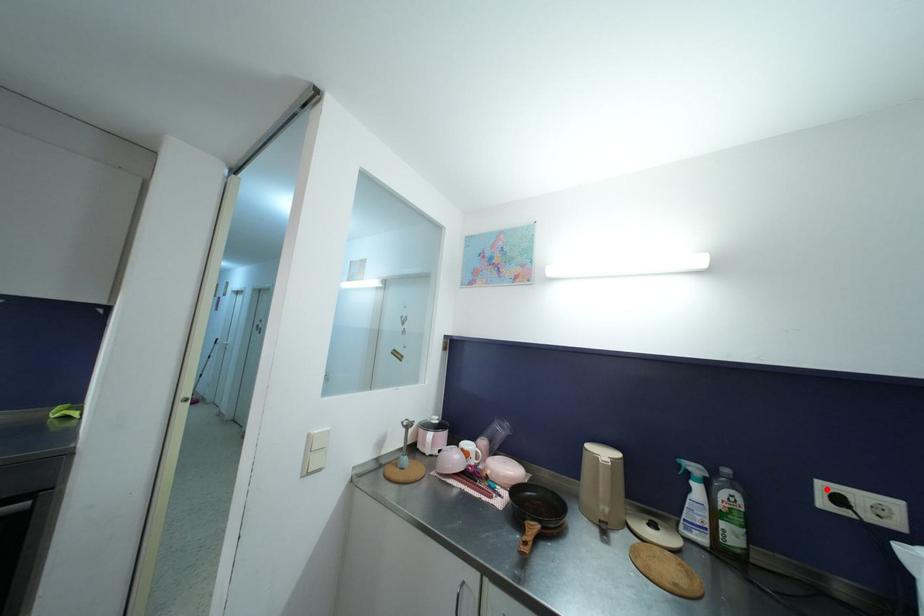
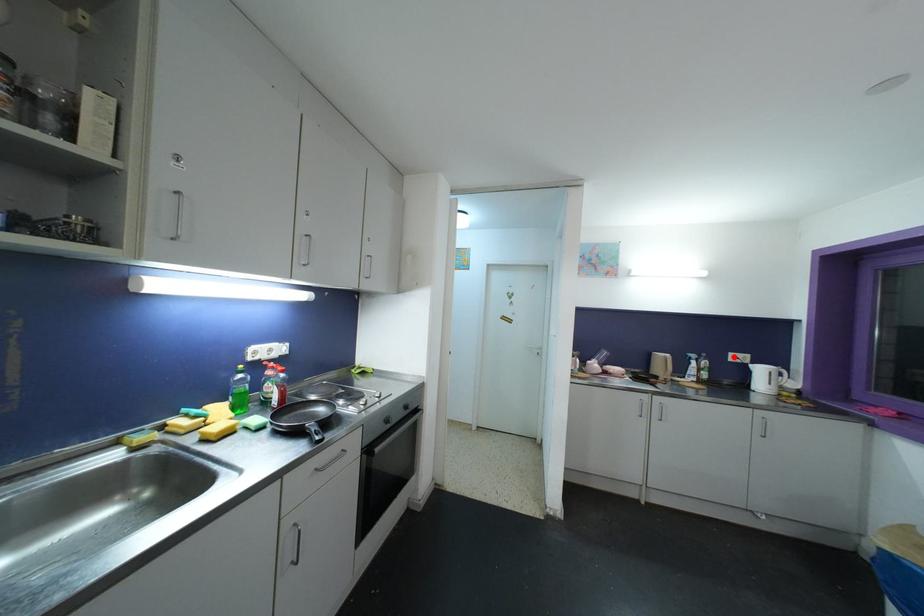
I am providing you with two images of the same scene from different viewpoints. A red point is marked on the first image and another point is marked on the second image. Is the marked point in image1 the same physical position as the marked point in image2?

Yes